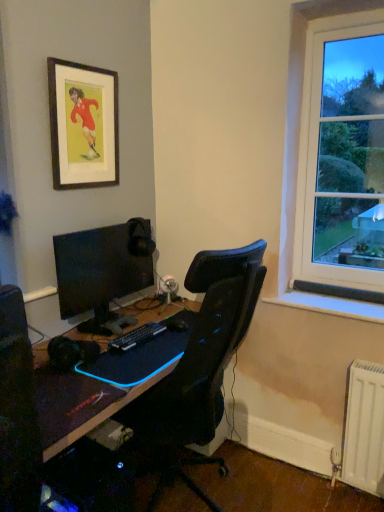
You are a GUI agent. You are given a task and a screenshot of the screen. Output one action in this format:
    pyautogui.click(x=<x>, y=<y>)
    Task: Click on the vacant space to the right of black plastic keyboard at center
    The image size is (384, 512).
    Given the screenshot: What is the action you would take?
    pyautogui.click(x=166, y=343)